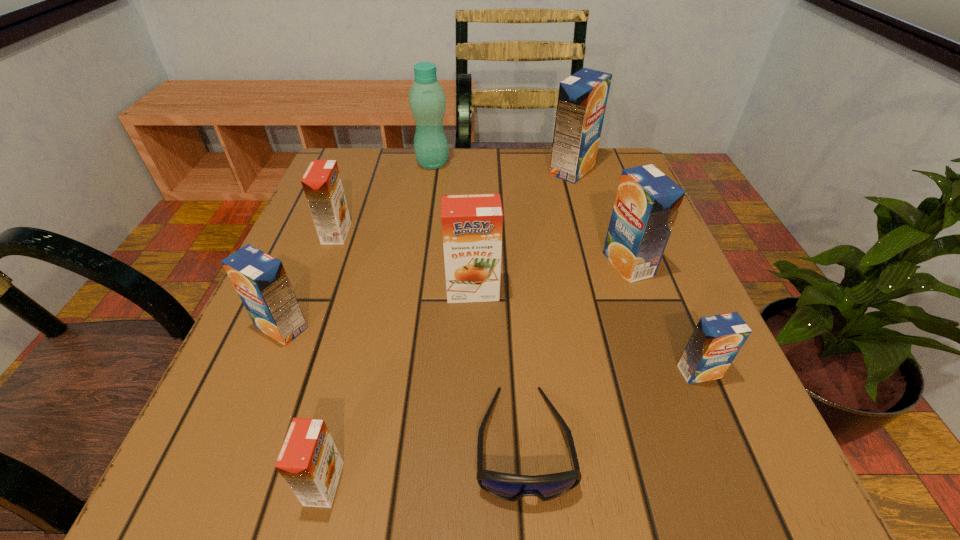
What are the coordinates of `vacant space at the far edge of the desktop` in the screenshot? It's located at (525, 163).

You are a GUI agent. You are given a task and a screenshot of the screen. Output one action in this format:
    pyautogui.click(x=<x>, y=<y>)
    Task: Click on the vacant space at the near edge of the desktop
    This screenshot has width=960, height=540.
    Given the screenshot: What is the action you would take?
    pyautogui.click(x=641, y=464)

Locate an element on the screen. Image resolution: width=960 pixels, height=540 pixels. vacant area at the left edge is located at coordinates (292, 392).

Where is `blank space at the right edge`? blank space at the right edge is located at coordinates (599, 227).

In the image, there is a desktop. Where is `free space at the far left corner`? free space at the far left corner is located at coordinates pyautogui.click(x=374, y=172).

In the image, there is a desktop. Where is `free space at the far right corner`? The height and width of the screenshot is (540, 960). free space at the far right corner is located at coordinates click(x=597, y=193).

This screenshot has width=960, height=540. In order to click on free spot between the blue sunglasses and the leftmost blue orange_juice in this screenshot , I will do `click(402, 385)`.

Locate an element on the screen. The image size is (960, 540). vacant area that lies between the farthest blue orange_juice and the leftmost blue orange_juice is located at coordinates (427, 249).

Where is `vacant area between the second nearest orange orange juice and the sixth farthest orange juice`? vacant area between the second nearest orange orange juice and the sixth farthest orange juice is located at coordinates (586, 331).

Locate an element on the screen. The width and height of the screenshot is (960, 540). free space between the second orange orange juice from right to left and the fifth farthest orange juice is located at coordinates (303, 406).